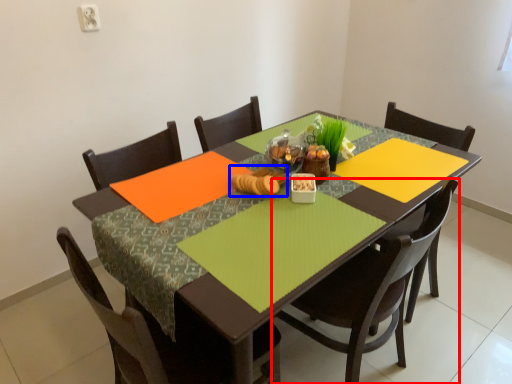
Question: Among these objects, which one is nearest to the camera, chair (highlighted by a red box) or food (highlighted by a blue box)?

Choices:
 (A) chair
 (B) food

Answer: (A)